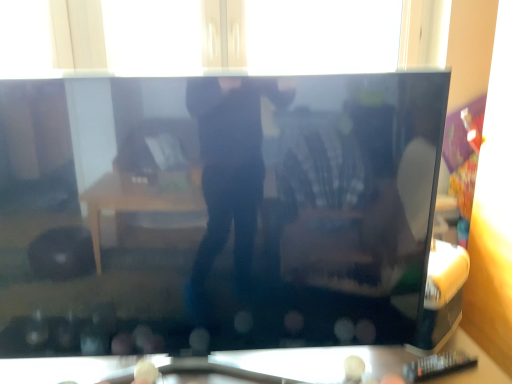
Question: Is point (479, 360) positioned closer to the camera than point (48, 200)?

Choices:
 (A) farther
 (B) closer

Answer: (A)

Question: Based on their sizes in the image, would you say transparent glass table at lower center is bigger or smaller than black glossy television at center?

Choices:
 (A) big
 (B) small

Answer: (B)

Question: Considering the real-world distances, which object is farthest from the transparent glass window at upper center?

Choices:
 (A) transparent glass table at lower center
 (B) black glossy television at center

Answer: (A)

Question: Estimate the real-world distances between objects in this image. Which object is closer to the transparent glass table at lower center?

Choices:
 (A) black glossy television at center
 (B) transparent glass window at upper center

Answer: (A)